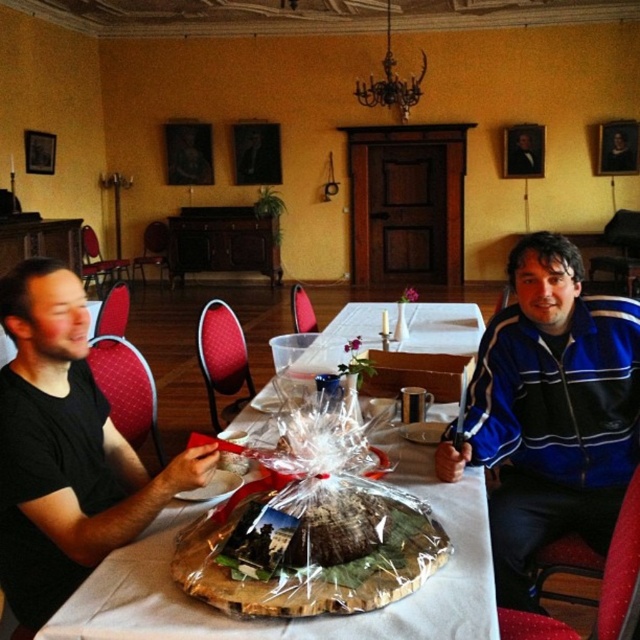
Question: Can you confirm if black matte shirt at left is positioned above translucent plastic table at center?

Choices:
 (A) no
 (B) yes

Answer: (A)

Question: Estimate the real-world distances between objects in this image. Which object is farther from the black matte shirt at left?

Choices:
 (A) translucent plastic table at center
 (B) translucent plastic cake at center

Answer: (A)

Question: Where is translucent plastic table at center located in relation to translucent plastic cake at center in the image?

Choices:
 (A) right
 (B) left

Answer: (A)

Question: Which of the following is the farthest from the observer?

Choices:
 (A) (412, 536)
 (B) (29, 420)

Answer: (B)

Question: Considering the relative positions of blue striped jacket at right and translucent plastic cake at center in the image provided, where is blue striped jacket at right located with respect to translucent plastic cake at center?

Choices:
 (A) right
 (B) left

Answer: (A)

Question: Among these objects, which one is farthest from the camera?

Choices:
 (A) translucent plastic table at center
 (B) black matte shirt at left
 (C) blue striped jacket at right
 (D) translucent plastic cake at center

Answer: (A)